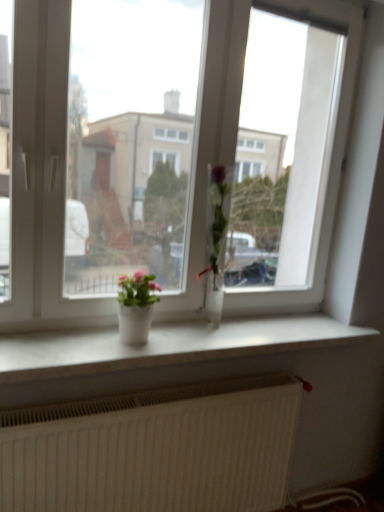
I want to click on vacant area that is in front of clear glass vase at center, marked as the first houseplant in a right-to-left arrangement, so click(x=206, y=340).